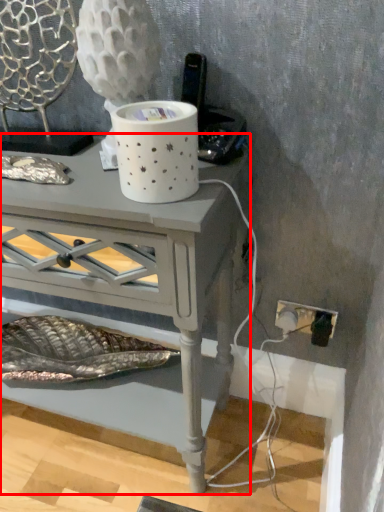
Question: Considering the relative positions of table (annotated by the red box) and swivel chair in the image provided, where is table (annotated by the red box) located with respect to the staircase?

Choices:
 (A) left
 (B) right

Answer: (B)